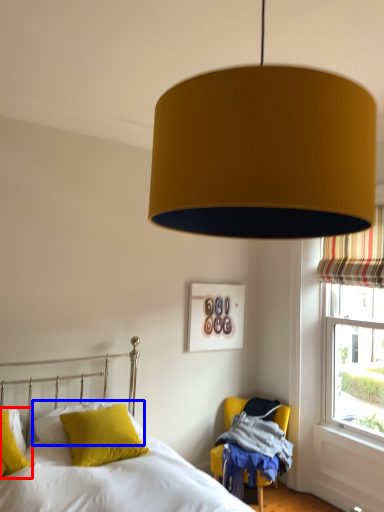
Question: Which object appears farthest to the camera in this image, pillow (highlighted by a red box) or pillow (highlighted by a blue box)?

Choices:
 (A) pillow
 (B) pillow

Answer: (B)